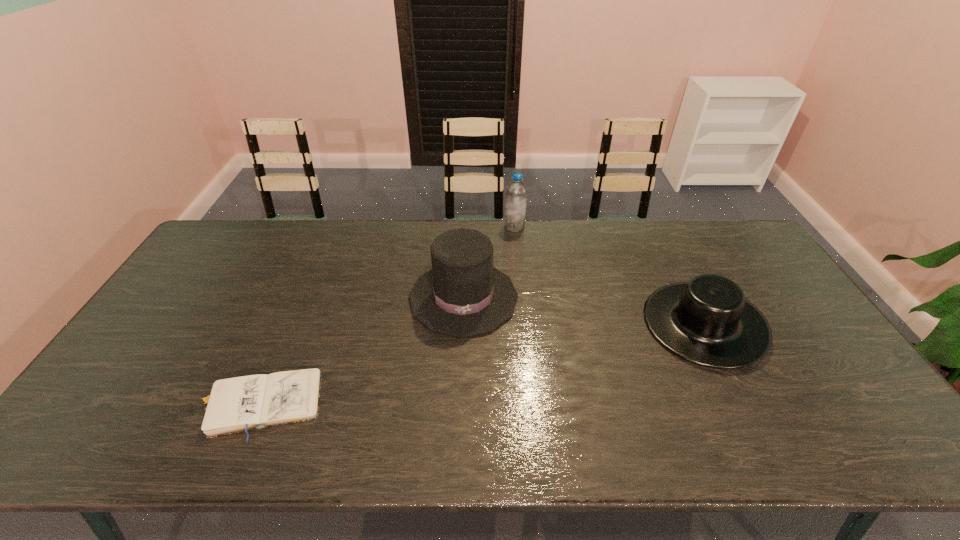
The width and height of the screenshot is (960, 540). I want to click on object at the far edge, so click(x=516, y=192).

You are a GUI agent. You are given a task and a screenshot of the screen. Output one action in this format:
    pyautogui.click(x=<x>, y=<y>)
    Task: Click on the object located in the near edge section of the desktop
    Image resolution: width=960 pixels, height=540 pixels.
    Given the screenshot: What is the action you would take?
    pyautogui.click(x=235, y=404)

I want to click on object that is positioned at the right edge, so click(707, 320).

In the image, there is a desktop. What are the coordinates of `vacant space at the far edge` in the screenshot? It's located at (708, 253).

At what (x,y) coordinates should I click in order to perform the action: click on vacant area at the near edge. Please return your answer as a coordinate pair (x, y). This screenshot has height=540, width=960. Looking at the image, I should click on (349, 455).

This screenshot has height=540, width=960. I want to click on vacant position at the left edge of the desktop, so click(145, 411).

I want to click on vacant region at the right edge of the desktop, so click(790, 315).

In the image, there is a desktop. Where is `free space at the far left corner`? This screenshot has width=960, height=540. free space at the far left corner is located at coordinates (235, 240).

In the image, there is a desktop. At what (x,y) coordinates should I click in order to perform the action: click on vacant space at the far right corner. Please return your answer as a coordinate pair (x, y). Looking at the image, I should click on (727, 247).

This screenshot has width=960, height=540. I want to click on empty location between the left dress hat and the leftmost object, so point(361,351).